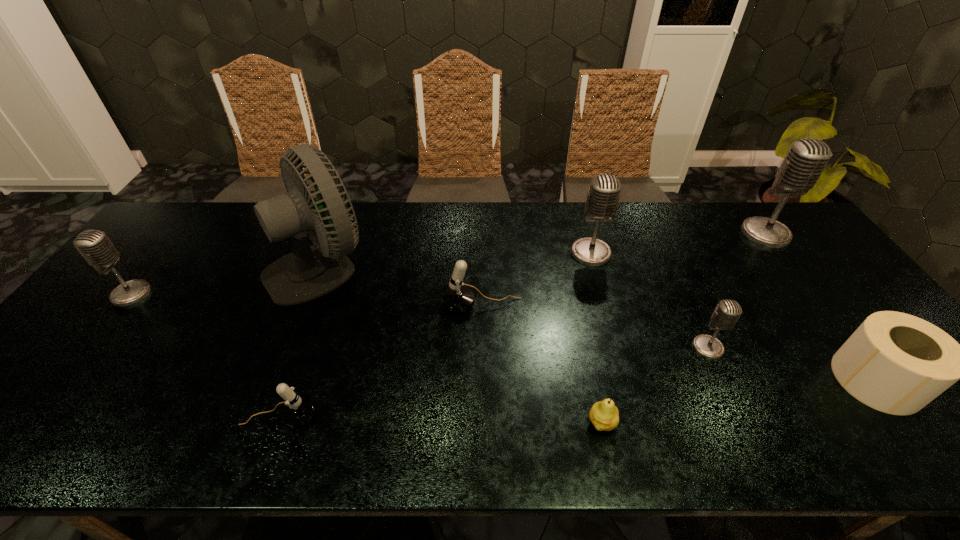
This screenshot has width=960, height=540. I want to click on gray fan, so click(x=308, y=272).

At what (x,y) coordinates should I click in order to perform the action: click on the tallest microphone. Please return your answer as a coordinate pair (x, y). Looking at the image, I should click on (806, 159).

Image resolution: width=960 pixels, height=540 pixels. I want to click on the biggest gray microphone, so click(x=806, y=159).

Find the location of a particular element. the third microphone from right to left is located at coordinates (602, 200).

Where is `the fifth shortest microphone`? The height and width of the screenshot is (540, 960). the fifth shortest microphone is located at coordinates (602, 200).

Find the location of `the leftmost microphone`. the leftmost microphone is located at coordinates tap(94, 245).

Image resolution: width=960 pixels, height=540 pixels. Identify the location of the fourth tallest object. (94, 245).

Identify the location of the third microphone from left to right. This screenshot has height=540, width=960. (458, 298).

The width and height of the screenshot is (960, 540). What are the coordinates of `the sixth object from right to left` in the screenshot? It's located at (458, 298).

Locate an element on the screen. Image resolution: width=960 pixels, height=540 pixels. the third object from right to left is located at coordinates (727, 312).